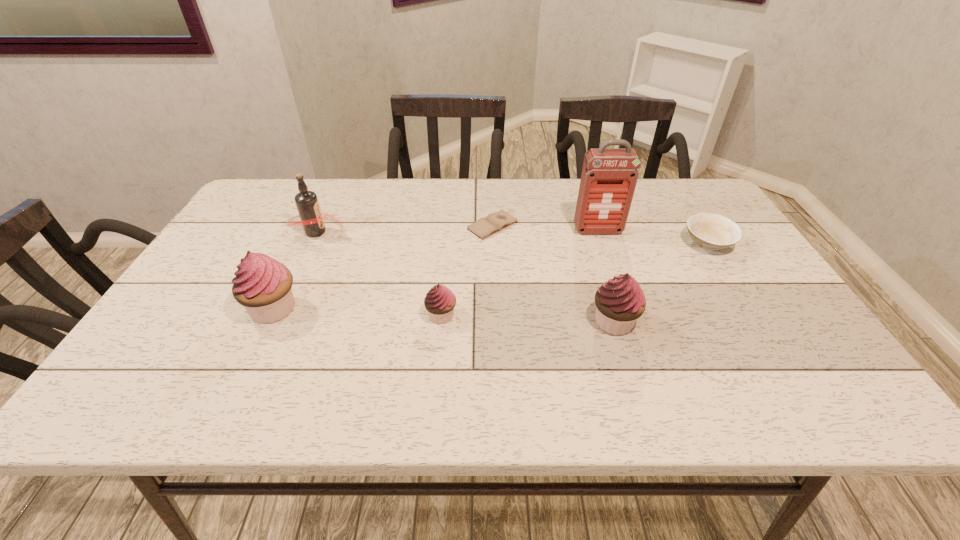
Find the location of a particular element. The width and height of the screenshot is (960, 540). object that is at the near edge is located at coordinates (620, 301).

Where is `object at the right edge`? This screenshot has width=960, height=540. object at the right edge is located at coordinates (709, 231).

Where is `vacant region at the far edge`? The height and width of the screenshot is (540, 960). vacant region at the far edge is located at coordinates (417, 213).

The image size is (960, 540). In the image, there is a desktop. What are the coordinates of `vacant space at the near edge` in the screenshot? It's located at (391, 347).

Locate an element on the screen. The width and height of the screenshot is (960, 540). vacant space at the left edge is located at coordinates (247, 225).

The height and width of the screenshot is (540, 960). Identify the location of vacant space at the right edge of the desktop. (684, 227).

Locate an element on the screen. Image resolution: width=960 pixels, height=540 pixels. vacant space at the far left corner is located at coordinates (283, 208).

The height and width of the screenshot is (540, 960). Find the location of `free region at the far right corner of the desktop`. free region at the far right corner of the desktop is located at coordinates (677, 183).

In the image, there is a desktop. Where is `vacant space at the near right corner`? vacant space at the near right corner is located at coordinates (774, 349).

At what (x,y) coordinates should I click in order to perform the action: click on vacant region between the leftmost cupcake and the bowl. Please return your answer as a coordinate pair (x, y). Looking at the image, I should click on (491, 276).